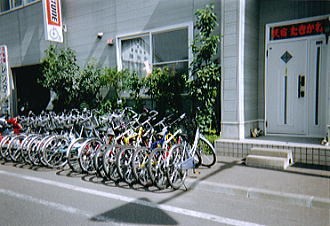
Locate an element on the screen. The image size is (330, 226). white door is located at coordinates (293, 68).